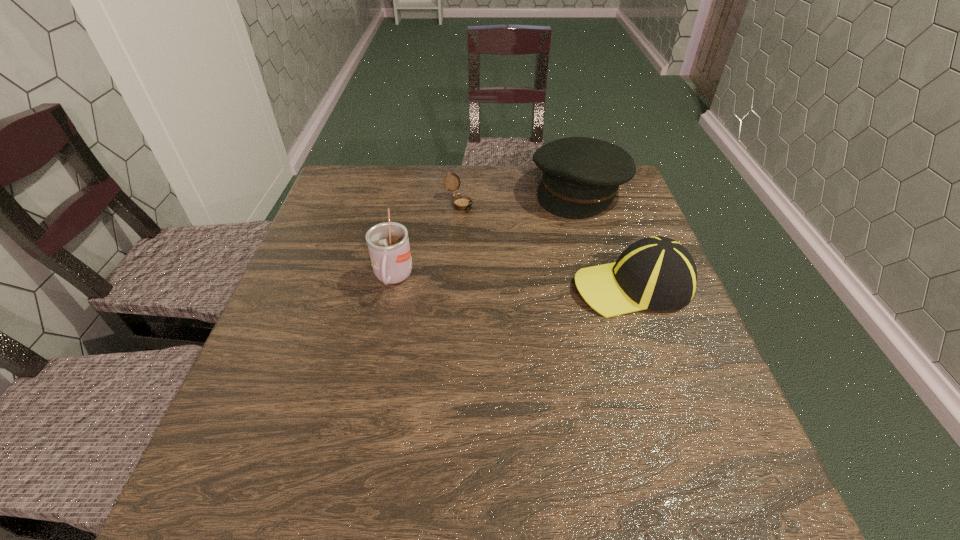
Identify the location of vacant space situated on the face of the compass. (482, 228).

Image resolution: width=960 pixels, height=540 pixels. I want to click on vacant region located on the face of the compass, so click(x=480, y=226).

Locate an element on the screen. free space located on the front-facing side of the beret is located at coordinates (515, 276).

At what (x,y) coordinates should I click in order to perform the action: click on vacant space situated 0.370m on the front-facing side of the beret. Please return your answer as a coordinate pair (x, y). The image size is (960, 540). Looking at the image, I should click on (496, 301).

Locate an element on the screen. free spot located on the front-facing side of the beret is located at coordinates (538, 246).

You are a GUI agent. You are given a task and a screenshot of the screen. Output one action in this format:
    pyautogui.click(x=<x>, y=<y>)
    Task: Click on the compass that is at the far edge
    The image size is (960, 540).
    Given the screenshot: What is the action you would take?
    pyautogui.click(x=461, y=202)

Image resolution: width=960 pixels, height=540 pixels. In order to click on beret at the far edge in this screenshot , I will do click(x=581, y=176).

Locate an element on the screen. The height and width of the screenshot is (540, 960). baseball cap located in the right edge section of the desktop is located at coordinates (658, 273).

Find the location of a particular element. beret that is at the right edge is located at coordinates (581, 176).

Image resolution: width=960 pixels, height=540 pixels. Find the location of `object located at the far right corner`. object located at the far right corner is located at coordinates (581, 176).